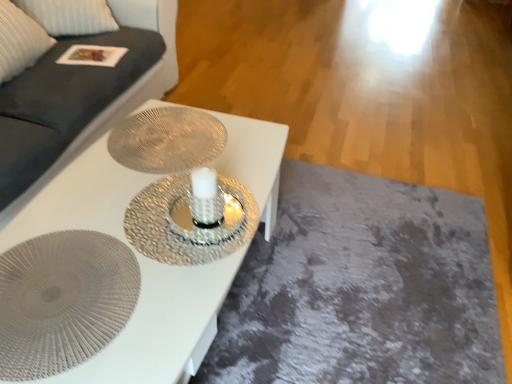
Locate an element on the screen. Image resolution: width=512 pixels, height=384 pixels. vacant area situated below metallic textured plate at center, the 2th oval when ordered from front to back (from a real-world perspective) is located at coordinates (170, 139).